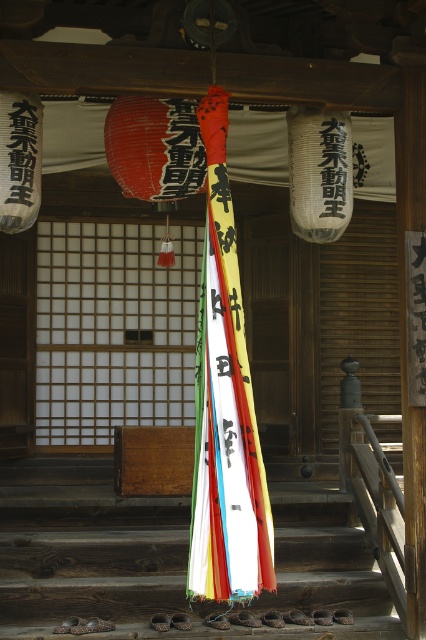
Question: Is white paper lantern at center further to camera compared to white paper lantern at upper left?

Choices:
 (A) no
 (B) yes

Answer: (B)

Question: Is white paper lantern at upper left thinner than black paper at center?

Choices:
 (A) yes
 (B) no

Answer: (B)

Question: Is red paper lantern at center positioned behind black paper at center?

Choices:
 (A) yes
 (B) no

Answer: (B)

Question: Which point is closer to the camera?

Choices:
 (A) wooden stairs at center
 (B) white paper lantern at center

Answer: (B)

Question: Among these objects, which one is nearest to the camera?

Choices:
 (A) white paper lantern at upper left
 (B) black paper at center

Answer: (A)

Question: Which object is closer to the camera taking this photo?

Choices:
 (A) white paper lantern at center
 (B) black paper at center
 (C) white paper lantern at upper left
 (D) red paper lantern at center

Answer: (C)